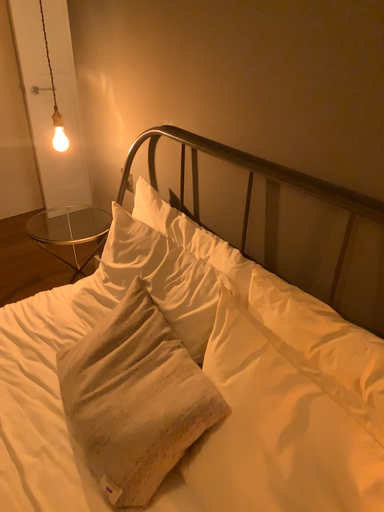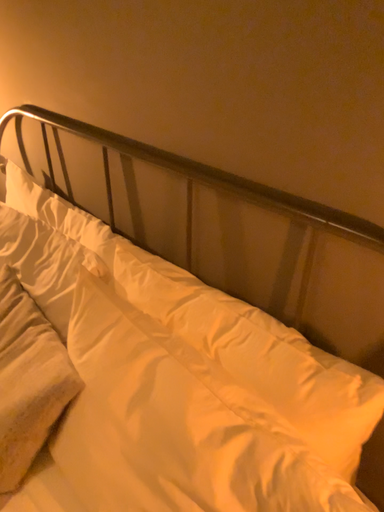
Question: How did the camera likely rotate when shooting the video?

Choices:
 (A) rotated left
 (B) rotated right

Answer: (B)